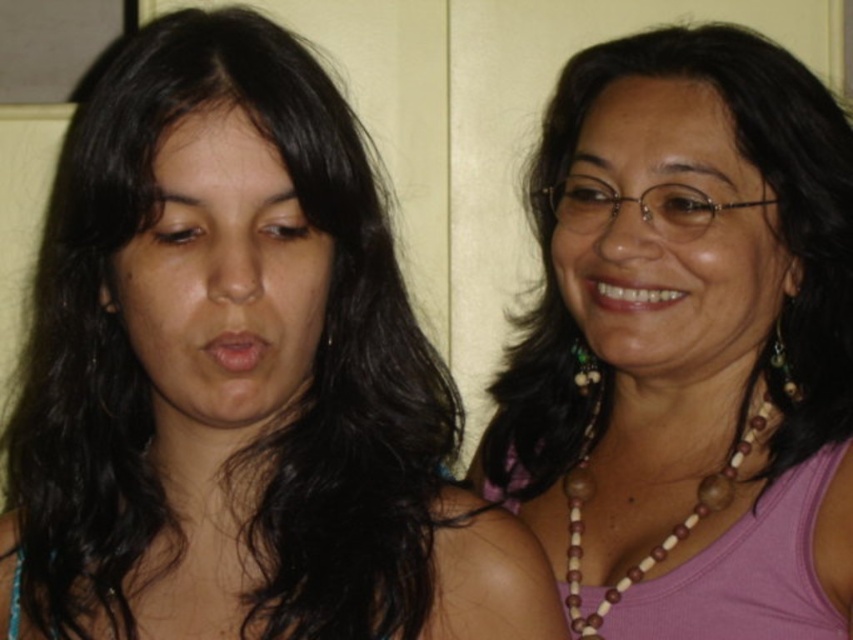
Can you confirm if matte skin face at left is positioned above white glossy teeth at center?

No.

Can you confirm if matte skin face at left is thinner than white glossy teeth at center?

No.

At what (x,y) coordinates should I click in order to perform the action: click on matte skin face at left. Please return your answer as a coordinate pair (x, y). Looking at the image, I should click on (221, 275).

Consider the image. Can you confirm if brown wooden necklace at upper right is shorter than brown wood beads at right?

In fact, brown wooden necklace at upper right may be taller than brown wood beads at right.

Is point (686, 285) behind point (584, 490)?

No, (686, 285) is in front of (584, 490).

Does point (712, 257) lie behind point (585, 477)?

No.

Identify the location of brown wooden necklace at upper right. (666, 232).

From the picture: Between pink beaded necklace at upper right and white glossy teeth at center, which one appears on the right side from the viewer's perspective?

Positioned to the right is pink beaded necklace at upper right.

Can you confirm if pink beaded necklace at upper right is positioned to the left of white glossy teeth at center?

No, pink beaded necklace at upper right is not to the left of white glossy teeth at center.

Which is behind, point (688, 611) or point (659, 296)?

Point (659, 296)

This screenshot has height=640, width=853. In order to click on pink beaded necklace at upper right in this screenshot , I will do `click(688, 346)`.